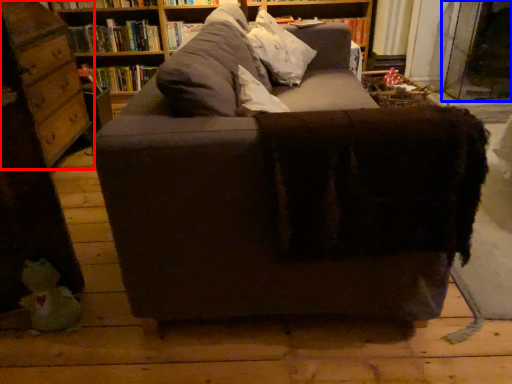
Question: Which point is further to the camera, shelf (highlighted by a red box) or glass door (highlighted by a blue box)?

Choices:
 (A) shelf
 (B) glass door

Answer: (B)